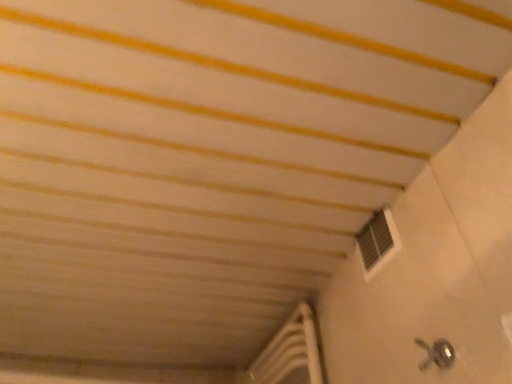
This screenshot has width=512, height=384. Find the location of `white grid vent at upper right`. white grid vent at upper right is located at coordinates (378, 241).

Describe the element at coordinates (378, 241) in the screenshot. I see `white grid vent at upper right` at that location.

You are a GUI agent. You are given a task and a screenshot of the screen. Output one action in this format:
    pyautogui.click(x=<x>, y=<y>)
    Task: Click on the white grid vent at upper right
    The height and width of the screenshot is (384, 512).
    Given the screenshot: What is the action you would take?
    pyautogui.click(x=378, y=241)